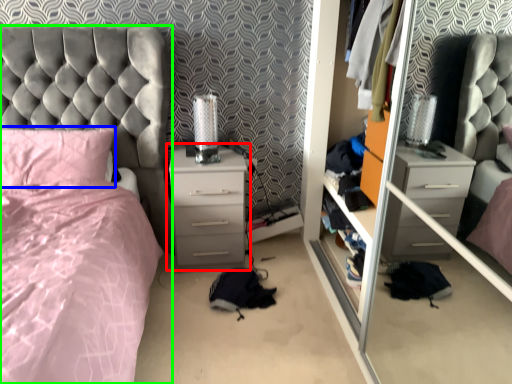
Question: Based on their relative distances, which object is nearer to chest of drawers (highlighted by a red box)? Choose from pillow (highlighted by a blue box) and bed (highlighted by a green box).

Choices:
 (A) pillow
 (B) bed

Answer: (B)